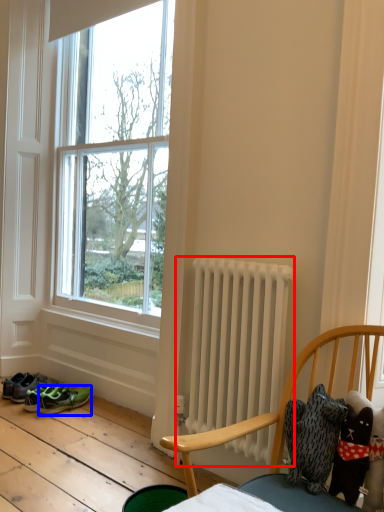
Question: Which of the following is the farthest to the observer, radiator (highlighted by a red box) or footwear (highlighted by a blue box)?

Choices:
 (A) radiator
 (B) footwear

Answer: (B)